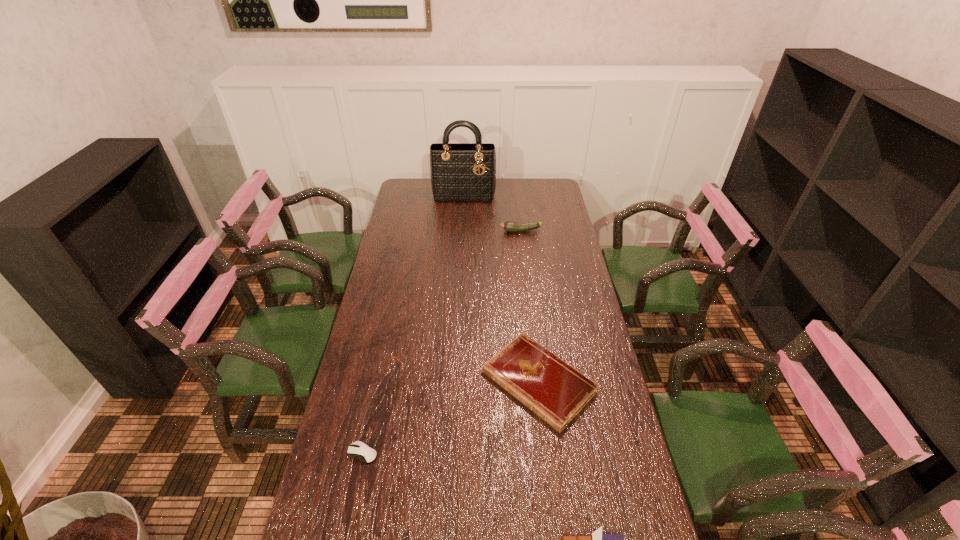
I want to click on the farthest object, so click(x=466, y=171).

This screenshot has width=960, height=540. I want to click on the tallest object, so click(x=466, y=171).

Locate an element on the screen. The height and width of the screenshot is (540, 960). the second farthest object is located at coordinates (511, 226).

Find the location of a particular element. The height and width of the screenshot is (540, 960). zucchini is located at coordinates (511, 226).

Identify the location of the third farthest object. The width and height of the screenshot is (960, 540). (555, 391).

The image size is (960, 540). In order to click on mouse in this screenshot , I will do `click(358, 449)`.

Where is `the fourth farthest object`? The width and height of the screenshot is (960, 540). the fourth farthest object is located at coordinates (358, 449).

Identify the location of vacant space located 0.210m at the front of the farthest object with visible charms. point(463,226).

Where is `vacant space located 0.270m at the blossom end of the fourth shortest object`? This screenshot has width=960, height=540. vacant space located 0.270m at the blossom end of the fourth shortest object is located at coordinates (442, 231).

Where is `vacant space located at the blossom end of the fourth shortest object`? This screenshot has width=960, height=540. vacant space located at the blossom end of the fourth shortest object is located at coordinates (483, 231).